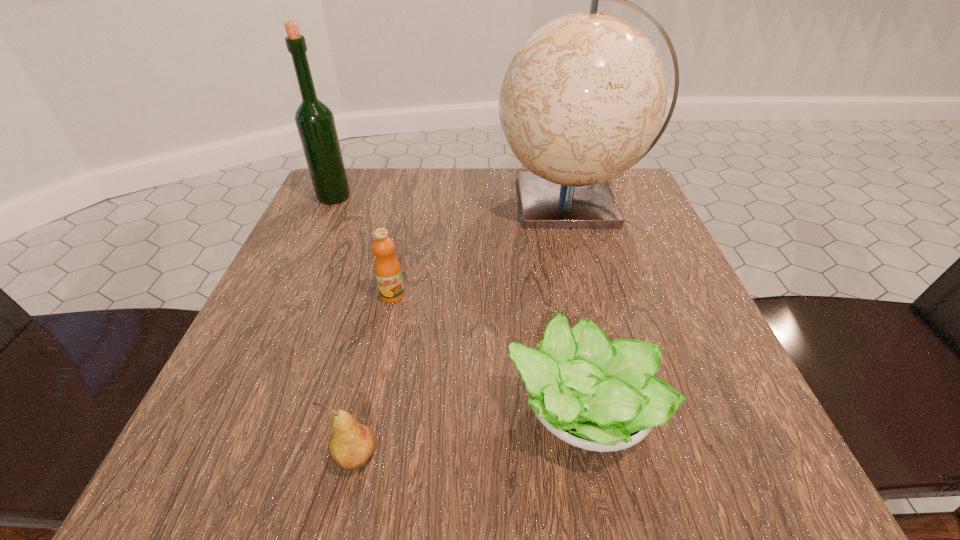
Find the location of a particular element. This screenshot has width=960, height=540. globe is located at coordinates (584, 96).

Where is `liquor`? liquor is located at coordinates (315, 122).

The image size is (960, 540). In order to click on the third nearest object in this screenshot , I will do `click(387, 268)`.

Find the location of a particular element. The width and height of the screenshot is (960, 540). pear is located at coordinates (351, 446).

At what (x,y) coordinates should I click in order to perform the action: click on lettuce. Please return your answer as a coordinate pair (x, y). This screenshot has height=540, width=960. Looking at the image, I should click on (600, 396).

The image size is (960, 540). What are the coordinates of `free space located 0.160m on the surface of the globe showing Europe and Africa` in the screenshot? It's located at (x=424, y=202).

Where is `vacant area located on the surface of the globe showing Europe and Africa`? The height and width of the screenshot is (540, 960). vacant area located on the surface of the globe showing Europe and Africa is located at coordinates (469, 202).

The height and width of the screenshot is (540, 960). Identify the location of vacant space situated 0.210m on the surface of the globe showing Europe and Africa. pos(402,202).

The width and height of the screenshot is (960, 540). In order to click on vacant space situated 0.060m on the front of the liquor in this screenshot , I will do `click(323, 222)`.

I want to click on vacant area situated on the front label of the third nearest object, so click(383, 340).